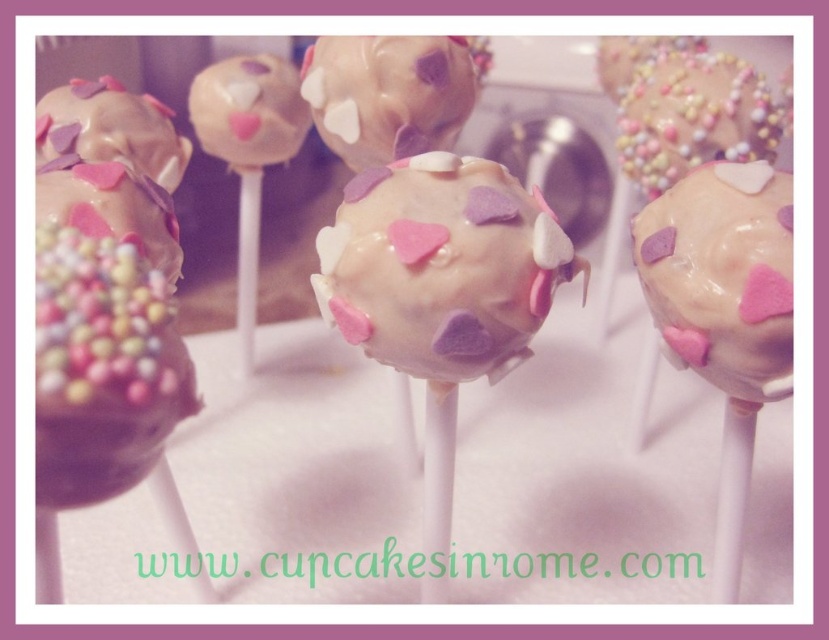
You are a photographer adjusting your camera settings for a closeup shot of the cake pops. The camera is currently focused on the point at coordinates point (191, 394). If you want to capture a subject that is 50 centimeters away, should you adjust the focus closer or farther away?

The point (191, 394) is 53.31 centimeters from the camera. Since 53.31 cm is farther than 50 cm, you should adjust the focus closer to capture a subject at 50 centimeters.

You are a customer at a bakery and see the white chocolate cake pop at center displayed on the table. If you want to reach it without moving any other items, where should you aim your hand?

The white chocolate cake pop at center is located at coordinates point (391, 92), so you should aim your hand at that specific point to reach it without disturbing other items.